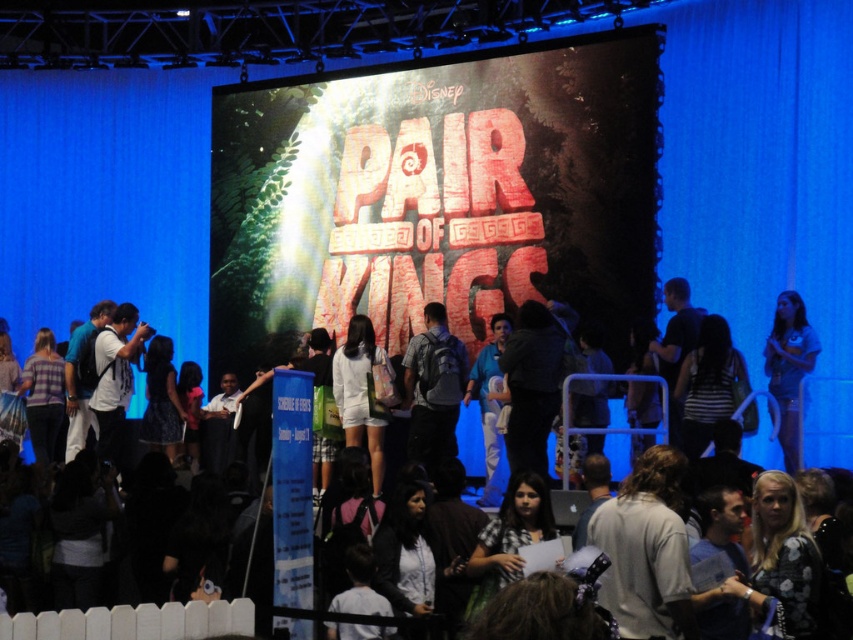
You are an event photographer at the Disney event. You need to capture a photo that includes both the dark fabric coat at center and the light blue denim shorts at right. Based on their positions, which object should be on the left side of your photo?

The dark fabric coat at center is positioned on the left side of light blue denim shorts at right, so in your photo, the dark fabric coat at center should be on the left side.

You are standing at the center of the image and see the matte gray backpack at center. If you move 0.1 units to the right and 0.05 units forward, will you be closer to the backpack?

The matte gray backpack at center is located at point (433,388). Moving 0.1 units to the right and 0.05 units forward would place you at position (476,452). Since the backpack is at (433,388), your new position is further away from the backpack in both the x and y coordinates. Therefore, you will not be closer to the matte gray backpack at center.

You are standing in the crowd at the Disney event and want to take a photo of both the point at coordinates (502,355) and the point at coordinates (801,340). Since you can only focus on one point at a time, which point should you focus on first to ensure the other is still in focus?

You should focus on point (502,355) first because it is closer to the camera than point (801,340). Since it is closer, focusing on it first will help keep the other point in focus as well.